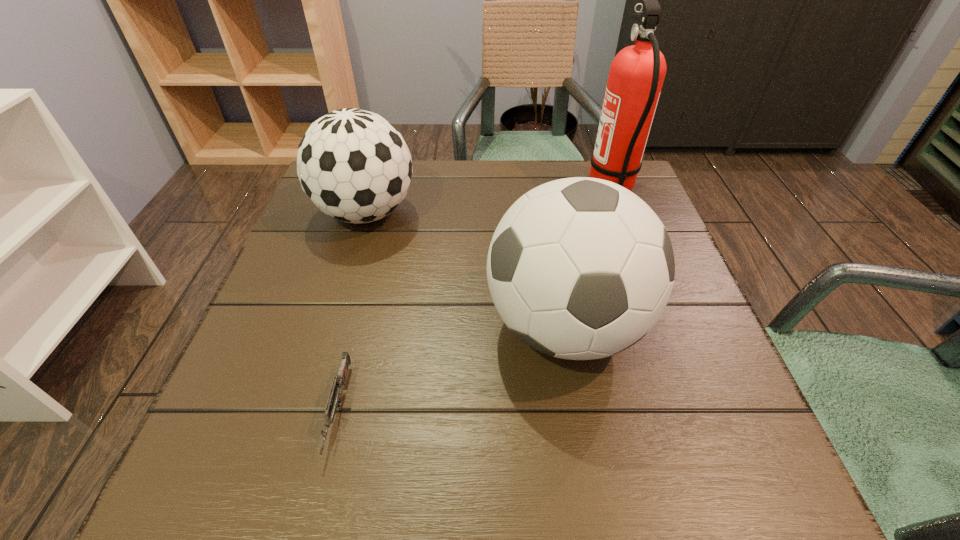
Where is `fire extinguisher`? The height and width of the screenshot is (540, 960). fire extinguisher is located at coordinates (636, 76).

Locate an element on the screen. the third shortest object is located at coordinates point(580,268).

The image size is (960, 540). I want to click on the taller soccer ball, so click(x=580, y=268).

This screenshot has width=960, height=540. Find the location of `the farther soccer ball`. the farther soccer ball is located at coordinates (355, 166).

I want to click on the third tallest object, so click(355, 166).

This screenshot has height=540, width=960. I want to click on gun, so click(335, 397).

Locate an element on the screen. Image resolution: width=960 pixels, height=540 pixels. vacant region located on the handle side of the tallest object is located at coordinates tap(464, 188).

I want to click on vacant point located on the handle side of the tallest object, so click(464, 188).

Identify the location of vacant area situated 0.350m on the handle side of the tallest object. (452, 188).

You are a GUI agent. You are given a task and a screenshot of the screen. Output one action in this format:
    pyautogui.click(x=<x>, y=<y>)
    Task: Click on the vacant space positioned on the left of the right soccer ball
    This screenshot has height=540, width=960.
    Given the screenshot: What is the action you would take?
    pyautogui.click(x=330, y=326)